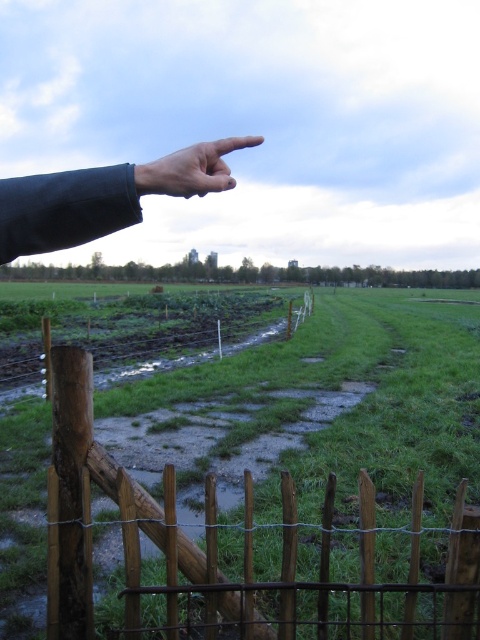
Question: Is green grassy field at center wider than smooth skin hand at upper left?

Choices:
 (A) yes
 (B) no

Answer: (A)

Question: Does green grassy field at center have a greater width compared to dark skin hand at upper left?

Choices:
 (A) no
 (B) yes

Answer: (B)

Question: Can you confirm if dark skin hand at upper left is wider than smooth skin hand at upper left?

Choices:
 (A) no
 (B) yes

Answer: (A)

Question: Which of the following is the farthest from the observer?

Choices:
 (A) (131, 180)
 (B) (27, 568)

Answer: (B)

Question: Which point is farther to the camera?

Choices:
 (A) green grassy field at center
 (B) smooth skin hand at upper left

Answer: (A)

Question: Which is nearer to the dark skin hand at upper left?

Choices:
 (A) smooth skin hand at upper left
 (B) green grassy field at center

Answer: (A)